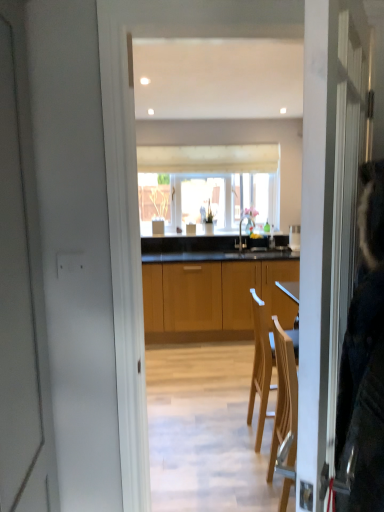
Question: Visually, is matte silver faucet at center positioned to the left or to the right of wooden cabinets at center?

Choices:
 (A) right
 (B) left

Answer: (A)

Question: Is matte silver faucet at center wider or thinner than wooden cabinets at center?

Choices:
 (A) thin
 (B) wide

Answer: (A)

Question: Based on their relative distances, which object is nearer to the white fabric window at center?

Choices:
 (A) matte silver faucet at center
 (B) wooden cabinets at center
 (C) white glossy kettle at center

Answer: (A)

Question: Estimate the real-world distances between objects in this image. Which object is closer to the white fabric window at center?

Choices:
 (A) white glossy kettle at center
 (B) matte silver faucet at center
 (C) wooden cabinets at center

Answer: (B)